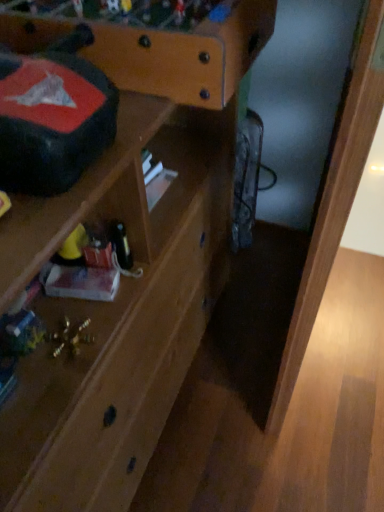
Question: Is light brown wood at lower right to the right of matte black writing desk at upper left from the viewer's perspective?

Choices:
 (A) yes
 (B) no

Answer: (A)

Question: Would you say light brown wood at lower right is outside matte black writing desk at upper left?

Choices:
 (A) yes
 (B) no

Answer: (A)

Question: Considering the relative sizes of light brown wood at lower right and matte black writing desk at upper left in the image provided, is light brown wood at lower right bigger than matte black writing desk at upper left?

Choices:
 (A) yes
 (B) no

Answer: (A)

Question: Is light brown wood at lower right behind matte black writing desk at upper left?

Choices:
 (A) no
 (B) yes

Answer: (A)

Question: Does light brown wood at lower right appear on the left side of matte black writing desk at upper left?

Choices:
 (A) yes
 (B) no

Answer: (B)

Question: Is light brown wood at lower right directly adjacent to matte black writing desk at upper left?

Choices:
 (A) yes
 (B) no

Answer: (B)

Question: From the image's perspective, is matte black writing desk at upper left under light brown wood at lower right?

Choices:
 (A) yes
 (B) no

Answer: (B)

Question: Can you confirm if matte black writing desk at upper left is shorter than light brown wood at lower right?

Choices:
 (A) no
 (B) yes

Answer: (B)

Question: From a real-world perspective, is matte black writing desk at upper left physically below light brown wood at lower right?

Choices:
 (A) no
 (B) yes

Answer: (A)

Question: Does matte black writing desk at upper left turn towards light brown wood at lower right?

Choices:
 (A) yes
 (B) no

Answer: (A)

Question: Does matte black writing desk at upper left touch light brown wood at lower right?

Choices:
 (A) no
 (B) yes

Answer: (A)

Question: Is matte black writing desk at upper left oriented away from light brown wood at lower right?

Choices:
 (A) no
 (B) yes

Answer: (A)

Question: Is matte black writing desk at upper left to the right of wooden shelf at center from the viewer's perspective?

Choices:
 (A) yes
 (B) no

Answer: (A)